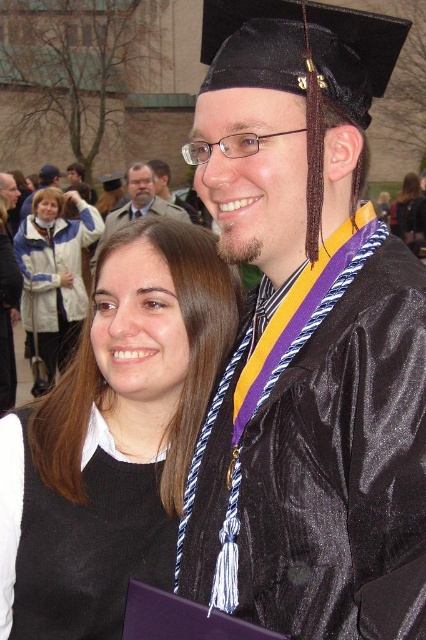
You are attending a graduation ceremony and notice two attendees wearing distinctive clothing. One is wearing a black sweater at center and the other a white fleece jacket at upper left. From your perspective as someone standing in the front row, which clothing item is positioned lower in the image?

The black sweater at center is located below the white fleece jacket at upper left, so the black sweater at center is positioned lower in the image.

You are attending a graduation ceremony and notice two attendees wearing the black sweater at center and the white fleece jacket at upper left. From your perspective, which one is closer to you?

The black sweater at center is closer to you because it is in front of the white fleece jacket at upper left.

Looking at this image, you are a photographer at the graduation ceremony. You want to take a photo of both the shiny black graduation gown at center and the matte black graduation gown at center. Can you fit both into the frame of your camera which has a maximum field of view of 25 meters? Explain your reasoning.

The shiny black graduation gown at center and the matte black graduation gown at center are 22.94 meters apart. Since the distance between them is less than the camera field of view of 25 meters, both can be captured in the same frame.